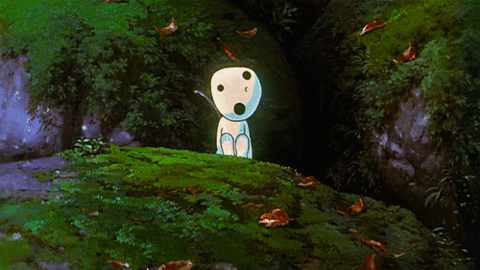
What are the coordinates of `chest` in the screenshot? It's located at (230, 123).